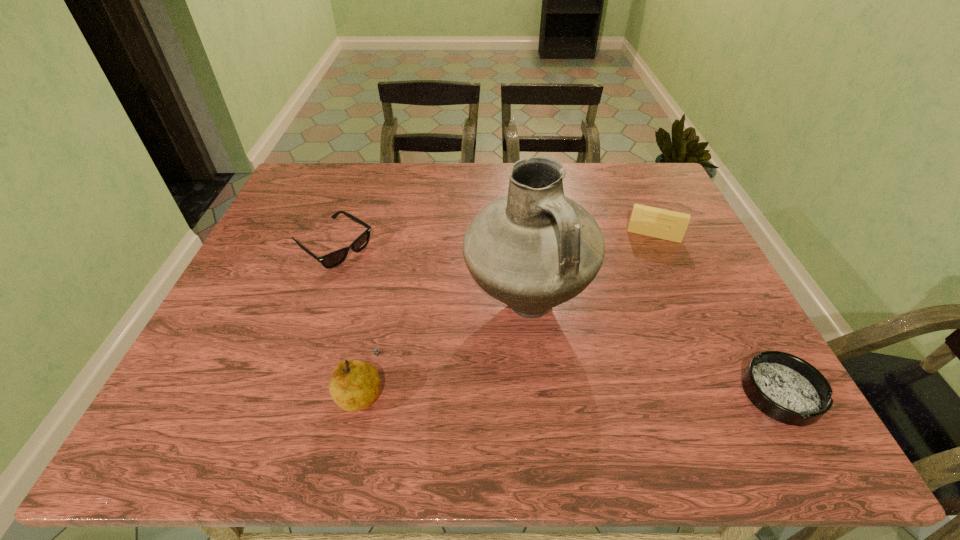
Locate an element on the screen. free point between the videotape and the ashtray is located at coordinates pyautogui.click(x=717, y=314).

Point out which object is positioned as the fourth nearest to the pear. Please provide its 2D coordinates. Your answer should be formatted as a tuple, i.e. [(x, y)], where the tuple contains the x and y coordinates of a point satisfying the conditions above.

[(664, 224)]

Where is `the third closest object to the second object from left to right`? The image size is (960, 540). the third closest object to the second object from left to right is located at coordinates (786, 388).

Find the location of a particular element. The image size is (960, 540). vacant region that satisfies the following two spatial constraints: 1. on the front side of the leftmost object; 2. on the left side of the second object from left to right is located at coordinates [x=281, y=390].

What are the coordinates of `free spot that satisfies the following two spatial constraints: 1. on the front side of the shortest object; 2. on the right side of the third object from left to right` in the screenshot? It's located at (536, 393).

You are a GUI agent. You are given a task and a screenshot of the screen. Output one action in this format:
    pyautogui.click(x=<x>, y=<y>)
    Task: Click on the vacant point that satisfies the following two spatial constraints: 1. on the front side of the shortest object; 2. on the left side of the pitcher
    
    Given the screenshot: What is the action you would take?
    [536, 393]

Where is `vacant region that satisfies the following two spatial constraints: 1. on the front side of the second object from left to right; 2. on the right side of the ashtray`? Image resolution: width=960 pixels, height=540 pixels. vacant region that satisfies the following two spatial constraints: 1. on the front side of the second object from left to right; 2. on the right side of the ashtray is located at coordinates (361, 393).